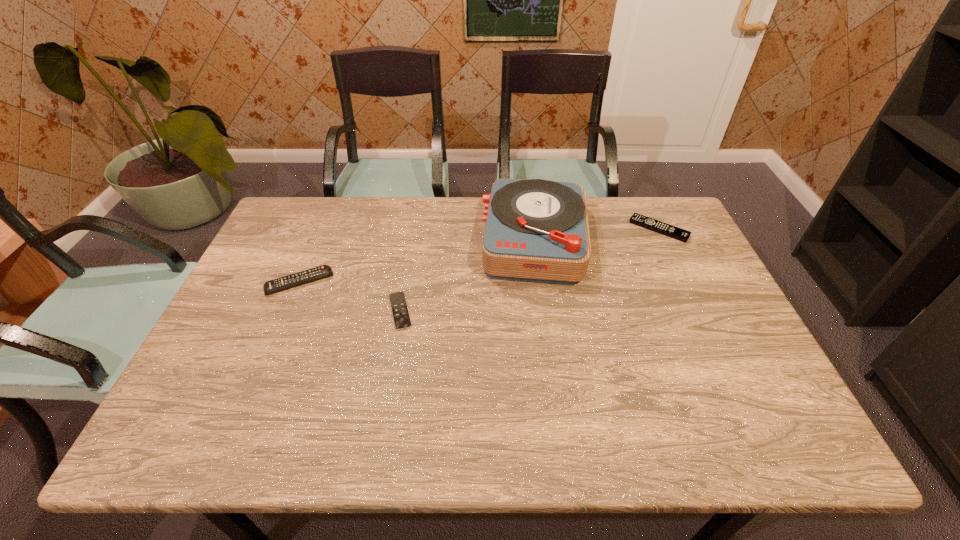
Image resolution: width=960 pixels, height=540 pixels. Find the location of `vacant space located on the left of the second tallest remote control`. vacant space located on the left of the second tallest remote control is located at coordinates (615, 229).

I want to click on vacant point located on the left of the second object from left to right, so click(x=273, y=311).

The image size is (960, 540). I want to click on record player that is at the far edge, so click(x=536, y=230).

This screenshot has width=960, height=540. I want to click on remote control that is at the far edge, so click(x=682, y=235).

What are the coordinates of `object that is at the left edge` in the screenshot? It's located at (289, 281).

The width and height of the screenshot is (960, 540). I want to click on object that is positioned at the right edge, so click(682, 235).

Locate an element on the screen. The width and height of the screenshot is (960, 540). object at the far right corner is located at coordinates (682, 235).

The width and height of the screenshot is (960, 540). I want to click on blank space at the far edge, so click(x=465, y=198).

The width and height of the screenshot is (960, 540). In the image, there is a desktop. What are the coordinates of `vacant space at the near edge` in the screenshot? It's located at (619, 432).

In the image, there is a desktop. Identify the location of vacant space at the right edge. This screenshot has height=540, width=960. (716, 362).